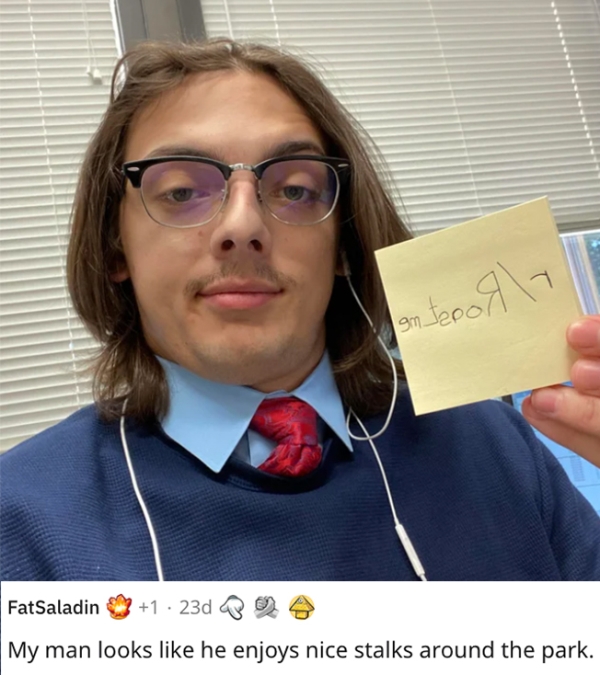
The height and width of the screenshot is (675, 600). Find the location of `window`. window is located at coordinates pyautogui.click(x=592, y=244).